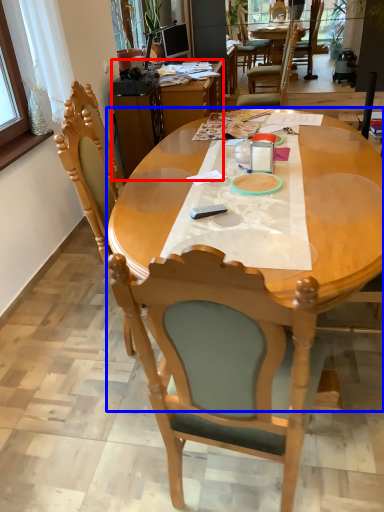
Question: Which point is closer to the camera, desk (highlighted by a red box) or kitchen & dining room table (highlighted by a blue box)?

Choices:
 (A) desk
 (B) kitchen & dining room table

Answer: (B)